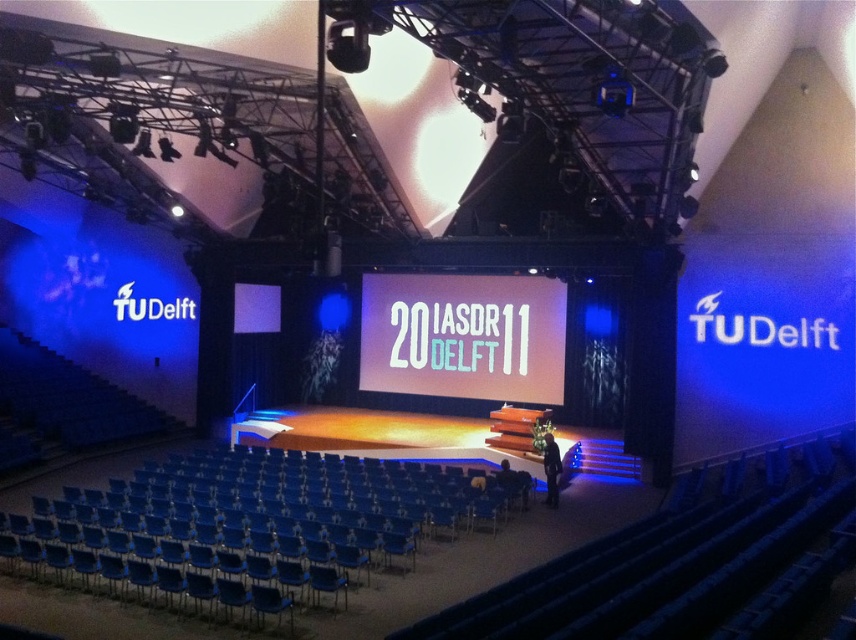
You are organizing a small meeting in the auditorium and need to place a table between the blue plastic chair at lower center and the white matte projection screen at center. Considering their sizes, which object should be placed closer to the table to ensure stability?

The blue plastic chair at lower center is smaller than the white matte projection screen at center, so the table should be placed closer to the larger white matte projection screen at center to ensure stability.

From the picture: You are an attendee at the event and want to move from your current position to the stage. There is a blue plastic chair at lower center and a white matte projection screen at center in your way. Which object should you move around to reach the stage?

You should move around the blue plastic chair at lower center since it is located to the left of the white matte projection screen at center, meaning it is closer to your path towards the stage.

You are an event organizer who needs to move a 12 meter long banner from the blue plastic chair at lower center to the white matte projection screen at center. Is there enough space to move the banner without folding it?

The blue plastic chair at lower center and white matte projection screen at center are 12.25 meters apart from each other. Since the banner is 12 meters long, there is enough space to move it without folding as the distance between them is slightly greater than the banner length.